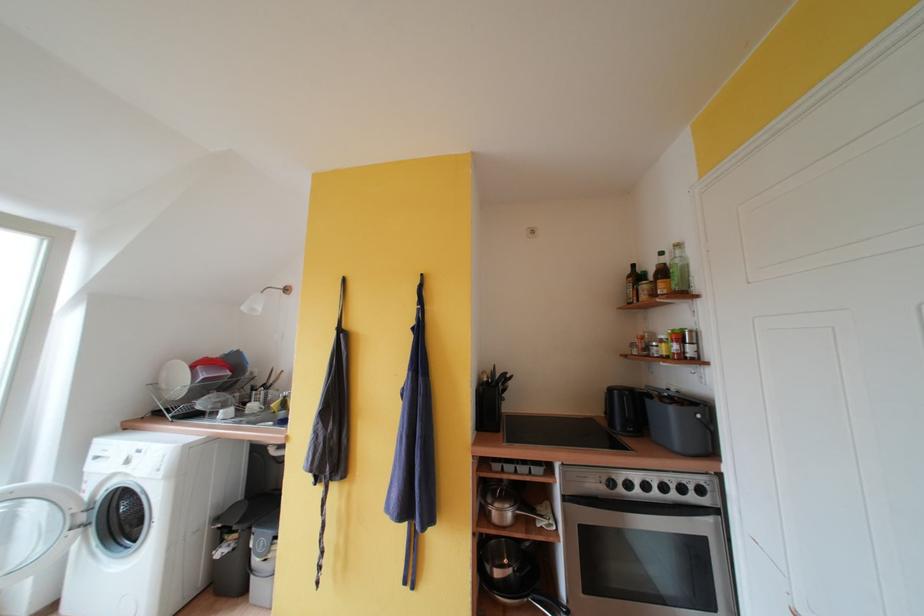
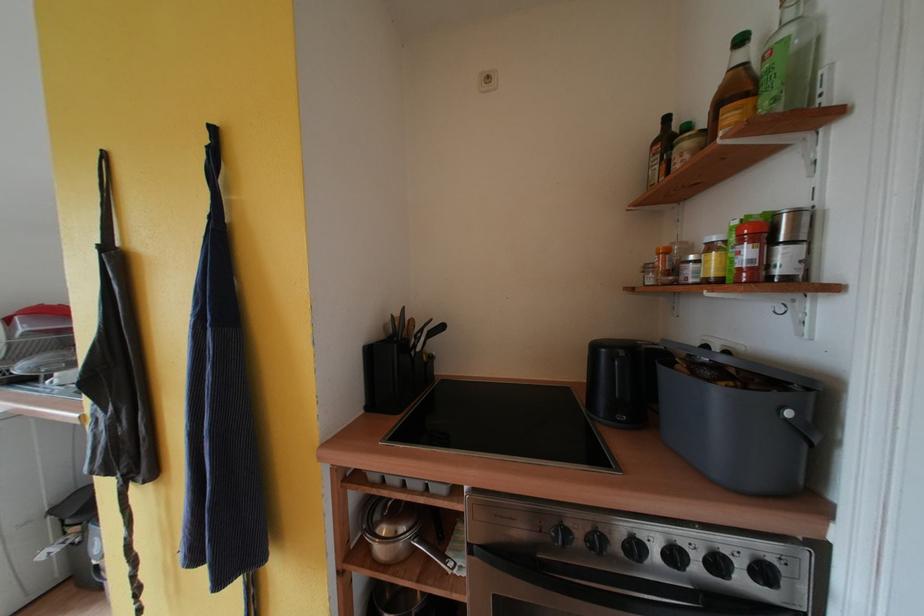
Question: The images are taken continuously from a first-person perspective. In which direction is your viewpoint rotating?

Choices:
 (A) Left
 (B) Right
 (C) Up
 (D) Down

Answer: (D)